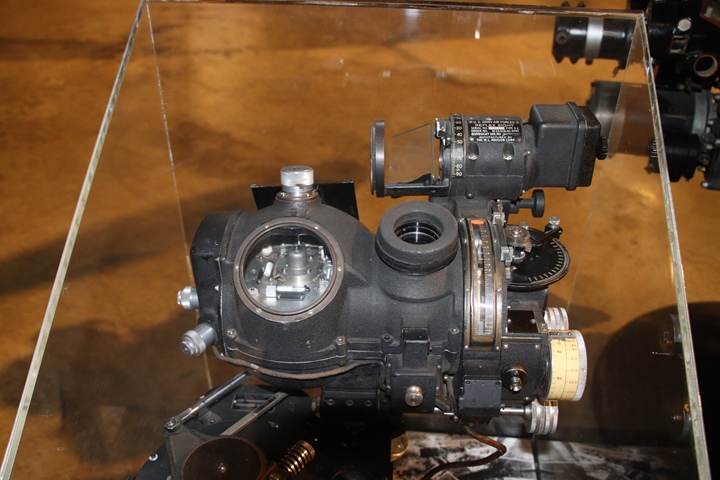
Where is `left glass case wall`? The width and height of the screenshot is (720, 480). left glass case wall is located at coordinates (94, 325).